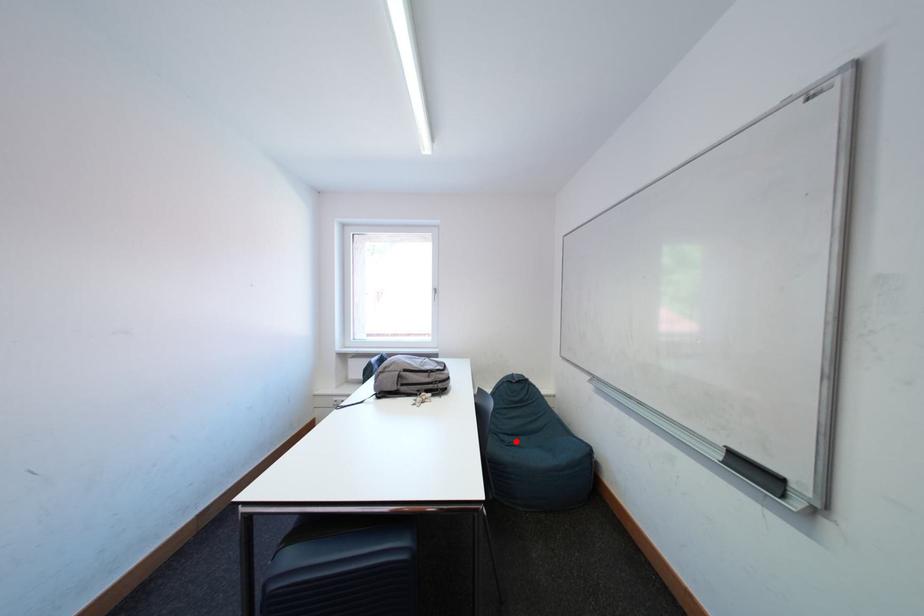
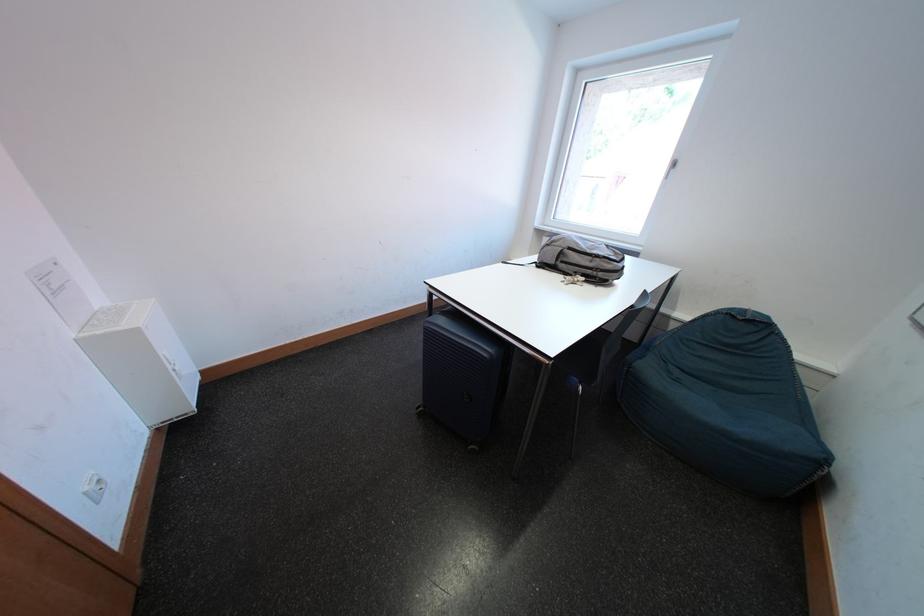
In the second image, find the point that corresponds to the highlighted location in the first image.

(687, 376)